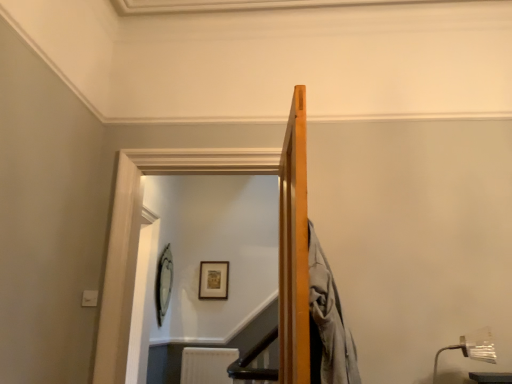
Find the location of a particular element. vacant point above white textured radiator at lower center (from a real-world perspective) is located at coordinates (221, 342).